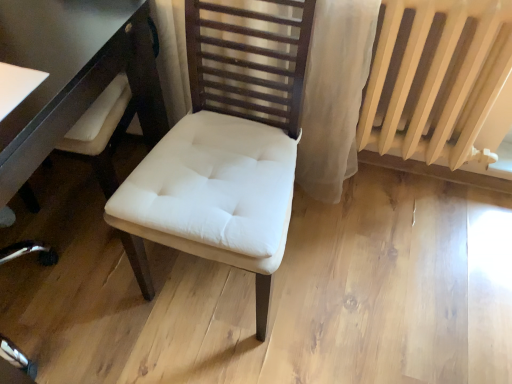
Where is `vacant area that lies to the right of white fabric chair at center`? This screenshot has height=384, width=512. vacant area that lies to the right of white fabric chair at center is located at coordinates 356,274.